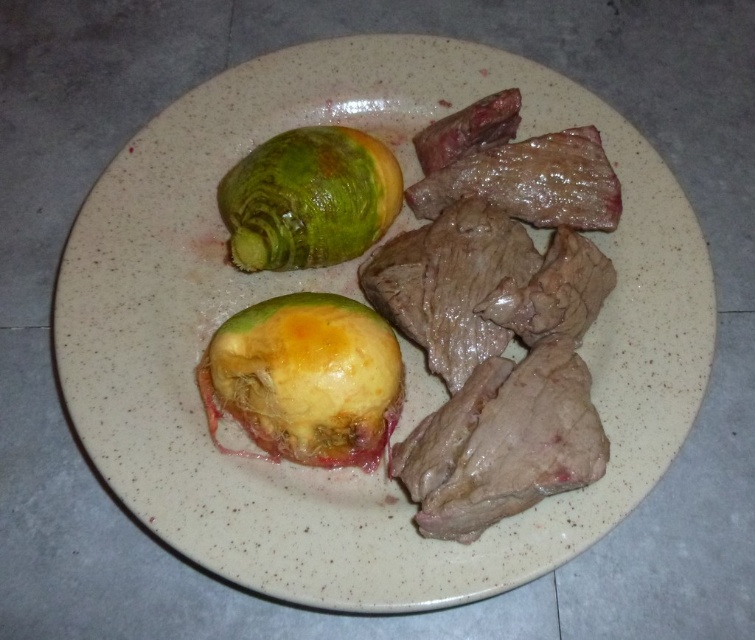
Question: Does yellowish matte fruit at center appear under green matte avocado at upper left?

Choices:
 (A) no
 (B) yes

Answer: (B)

Question: Which of the following is the farthest from the observer?

Choices:
 (A) (270, 372)
 (B) (260, 205)

Answer: (B)

Question: Which of the following is the farthest from the observer?

Choices:
 (A) (242, 397)
 (B) (227, 244)

Answer: (B)

Question: Which point is closer to the camera?

Choices:
 (A) (356, 403)
 (B) (233, 252)

Answer: (A)

Question: Is yellowish matte fruit at center in front of green matte avocado at upper left?

Choices:
 (A) no
 (B) yes

Answer: (B)

Question: From the image, what is the correct spatial relationship of yellowish matte fruit at center in relation to green matte avocado at upper left?

Choices:
 (A) above
 (B) below

Answer: (B)